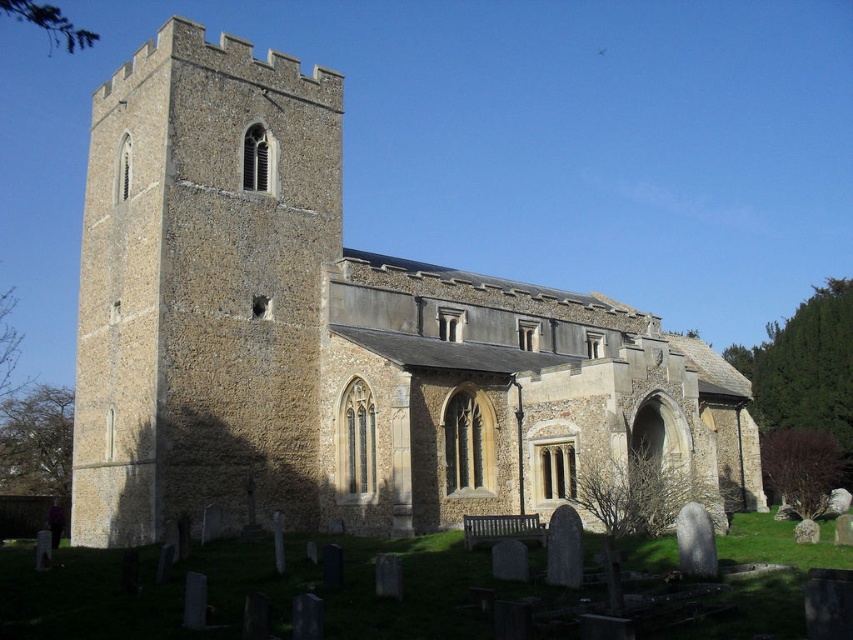
Between brown stone church at center and brown stone tower at left, which one is positioned lower?

brown stone church at center

Is point (439, 484) in front of point (106, 417)?

Yes, it is in front of point (106, 417).

Between point (154, 273) and point (331, 196), which one is positioned in front?

Point (154, 273)

The image size is (853, 640). I want to click on brown stone church at center, so click(335, 337).